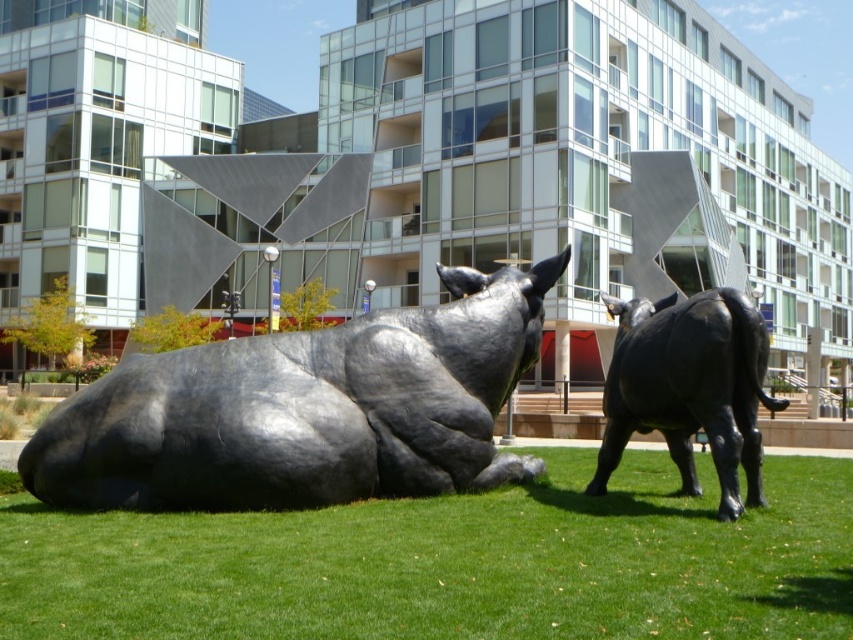
Question: Which point appears closest to the camera in this image?

Choices:
 (A) (733, 406)
 (B) (392, 433)

Answer: (A)

Question: Can you confirm if polished black bull at center is bigger than black polished metal bull at right?

Choices:
 (A) no
 (B) yes

Answer: (A)

Question: Is polished black bull at center above black polished metal bull at right?

Choices:
 (A) yes
 (B) no

Answer: (B)

Question: Which point is farther from the camera taking this photo?

Choices:
 (A) (239, 493)
 (B) (669, 316)

Answer: (B)

Question: In this image, where is polished black bull at center located relative to black polished metal bull at right?

Choices:
 (A) below
 (B) above

Answer: (A)